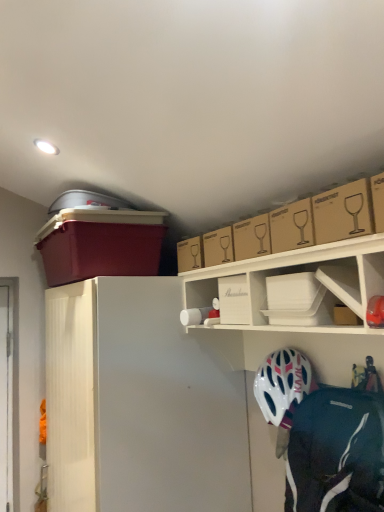
Question: From a real-world perspective, is white matte shelf at upper center positioned under white plastic container at upper center, the 2th box in the front-to-back sequence, based on gravity?

Choices:
 (A) yes
 (B) no

Answer: (A)

Question: Is white matte shelf at upper center bigger than white plastic container at upper center, positioned as the third box in left-to-right order?

Choices:
 (A) no
 (B) yes

Answer: (B)

Question: Does white matte shelf at upper center appear on the right side of white plastic container at upper center, marked as the 3th box in a back-to-front arrangement?

Choices:
 (A) yes
 (B) no

Answer: (B)

Question: Is white matte shelf at upper center oriented away from white plastic container at upper center, the 2th box in the front-to-back sequence?

Choices:
 (A) yes
 (B) no

Answer: (A)

Question: Is white matte shelf at upper center thinner than white plastic container at upper center, the 2th box in the front-to-back sequence?

Choices:
 (A) yes
 (B) no

Answer: (B)

Question: In the image, is matte plastic storage bin at upper left, which is the 1th box in back-to-front order, on the left side or the right side of white matte helmet at lower right?

Choices:
 (A) left
 (B) right

Answer: (A)

Question: Do you think matte plastic storage bin at upper left, which is the 1th box in back-to-front order, is within white matte helmet at lower right, or outside of it?

Choices:
 (A) inside
 (B) outside

Answer: (B)

Question: Is matte plastic storage bin at upper left, which is the 4th box from front to back, in front of or behind white matte helmet at lower right in the image?

Choices:
 (A) behind
 (B) front

Answer: (A)

Question: Considering the positions of matte plastic storage bin at upper left, which is counted as the first box, starting from the left, and white matte helmet at lower right in the image, is matte plastic storage bin at upper left, which is counted as the first box, starting from the left, taller or shorter than white matte helmet at lower right?

Choices:
 (A) short
 (B) tall

Answer: (A)

Question: Is brown cardboard box at upper center, which ranks as the second box in left-to-right order, inside the boundaries of brown cardboard box at upper right, marked as the 4th box in a back-to-front arrangement, or outside?

Choices:
 (A) inside
 (B) outside

Answer: (B)

Question: Is brown cardboard box at upper center, the 2th box from the back, wider or thinner than brown cardboard box at upper right, which ranks as the 1th box in front-to-back order?

Choices:
 (A) thin
 (B) wide

Answer: (A)

Question: Does point pyautogui.click(x=228, y=227) appear closer or farther from the camera than point pyautogui.click(x=372, y=202)?

Choices:
 (A) farther
 (B) closer

Answer: (A)

Question: From a real-world perspective, is brown cardboard box at upper center, the 2th box from the back, above or below brown cardboard box at upper right, which is counted as the 1th box, starting from the right?

Choices:
 (A) above
 (B) below

Answer: (B)

Question: Is brown cardboard box at upper right, the 4th box from the left, wider or thinner than transparent plastic screen door at left?

Choices:
 (A) wide
 (B) thin

Answer: (A)

Question: Is brown cardboard box at upper right, which ranks as the 1th box in front-to-back order, taller or shorter than transparent plastic screen door at left?

Choices:
 (A) tall
 (B) short

Answer: (B)